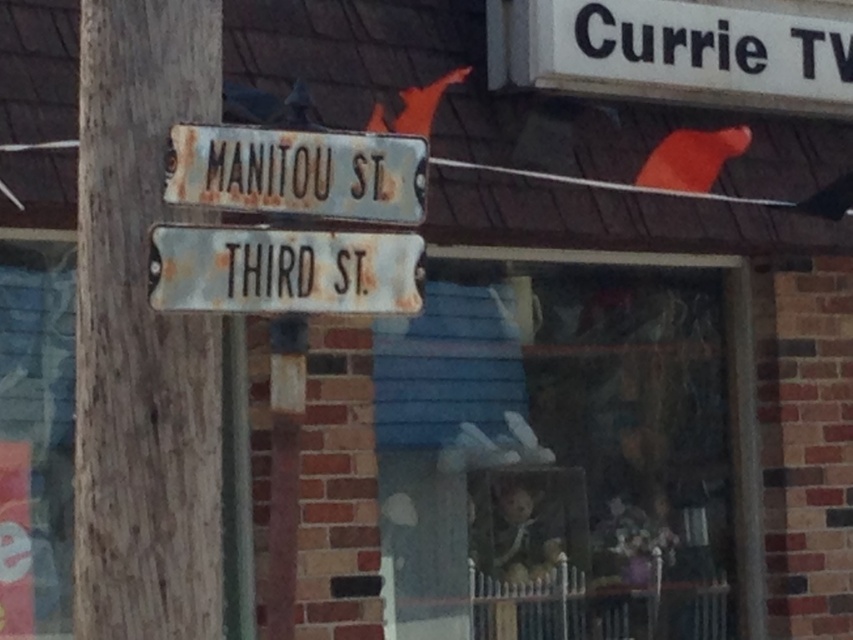
Question: From the image, what is the correct spatial relationship of blue wooden fence at center in relation to rusty metal pole at left?

Choices:
 (A) below
 (B) above

Answer: (B)

Question: Which object appears farthest from the camera in this image?

Choices:
 (A) blue wooden fence at center
 (B) rusty metal pole at left
 (C) rusty wood telegraph pole at left

Answer: (A)

Question: Can you confirm if blue wooden fence at center is positioned above rusty metal pole at left?

Choices:
 (A) no
 (B) yes

Answer: (B)

Question: Which object is positioned closest to the rusty metal street sign at center?

Choices:
 (A) blue wooden fence at center
 (B) rusty metal street sign at upper center
 (C) rusty metal pole at left

Answer: (B)

Question: Is blue wooden fence at center wider than rusty metal pole at left?

Choices:
 (A) yes
 (B) no

Answer: (A)

Question: Which object is farther from the camera taking this photo?

Choices:
 (A) rusty metal street sign at center
 (B) rusty metal street sign at upper center
 (C) rusty wood telegraph pole at left
 (D) blue wooden fence at center

Answer: (D)